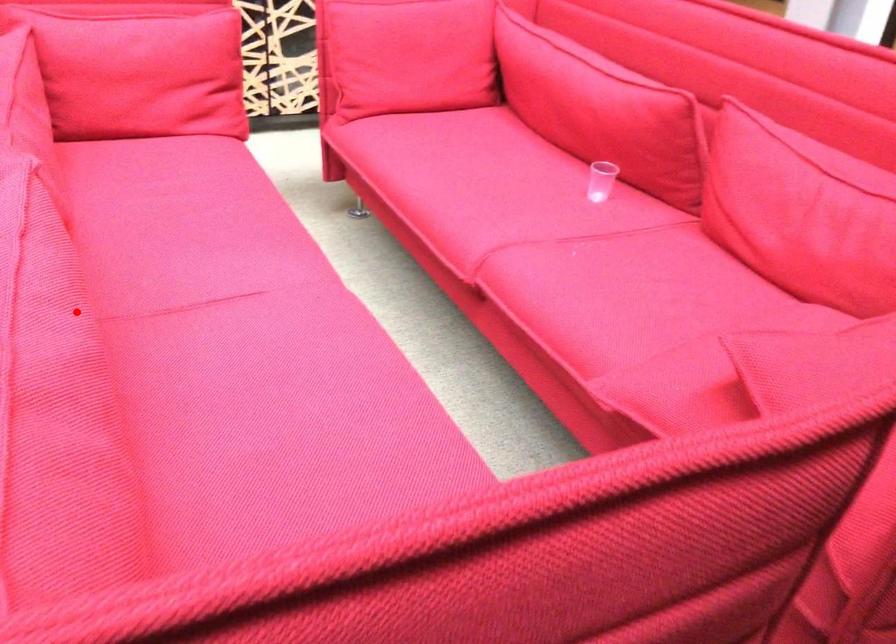
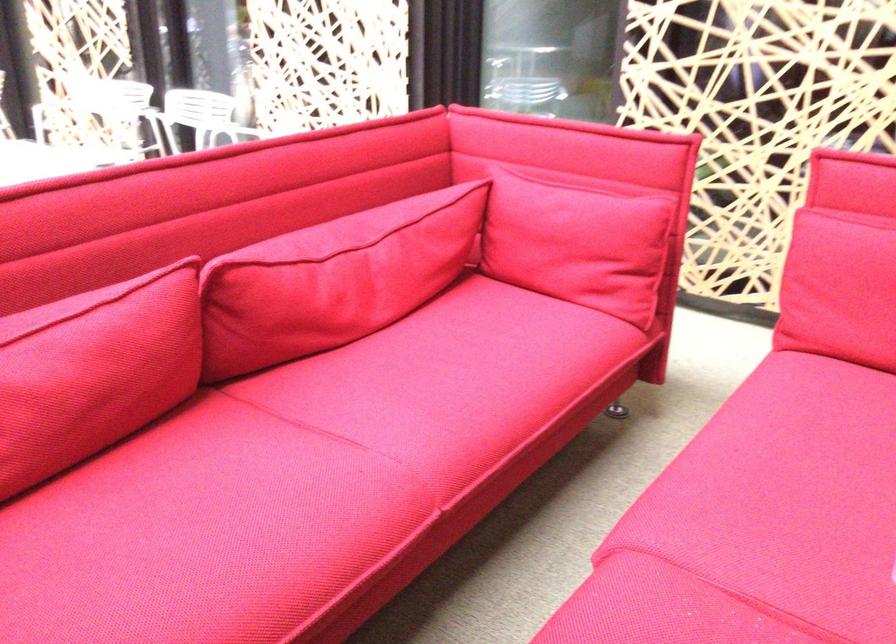
Question: I am providing you with two images of the same scene from different viewpoints. A red point is marked on the first image. At the location where the point appears in image 1, is it still visible in image 2?

Choices:
 (A) Yes
 (B) No

Answer: (A)